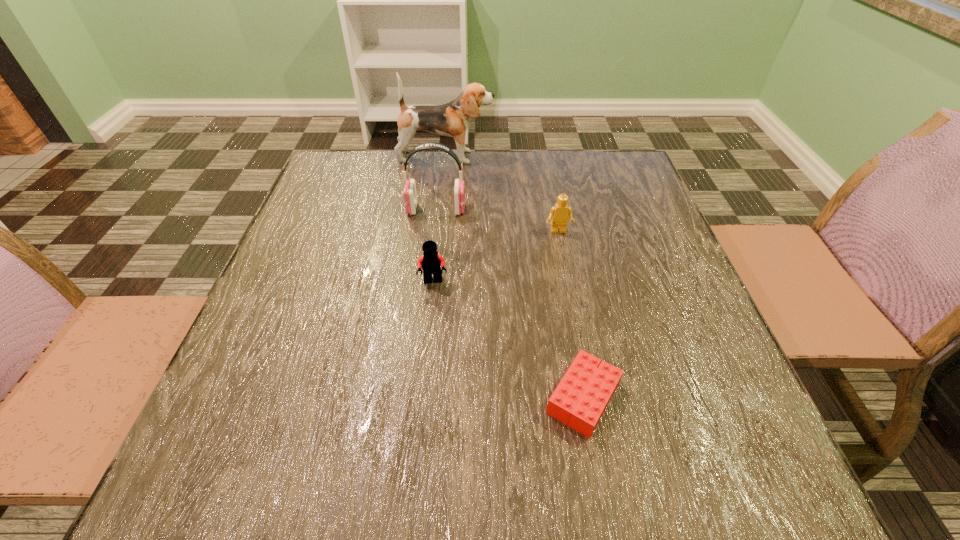
In order to click on vacant region at the far right corner of the desktop in this screenshot , I will do `click(625, 176)`.

Find the location of a particular element. The image size is (960, 540). vacant point located between the shortest Lego and the fourth nearest object is located at coordinates (510, 303).

Locate an element on the screen. The width and height of the screenshot is (960, 540). free space between the third farthest object and the puppy is located at coordinates (502, 194).

You are a GUI agent. You are given a task and a screenshot of the screen. Output one action in this format:
    pyautogui.click(x=<x>, y=<y>)
    Task: Click on the vacant space in between the nearest Lego and the farthest object
    This screenshot has width=960, height=540.
    Given the screenshot: What is the action you would take?
    pyautogui.click(x=515, y=278)

This screenshot has width=960, height=540. I want to click on blank region between the farthest object and the second nearest object, so click(x=440, y=219).

The image size is (960, 540). I want to click on free space between the shortest Lego and the tallest object, so click(x=515, y=278).

Where is `unoccupied area between the farthest Lego and the fourth shortest object`? The height and width of the screenshot is (540, 960). unoccupied area between the farthest Lego and the fourth shortest object is located at coordinates (497, 220).

Locate an element on the screen. This screenshot has height=540, width=960. empty location between the farthest object and the farthest Lego is located at coordinates [502, 194].

Locate an element on the screen. The image size is (960, 540). vacant space that is in between the second farthest Lego and the tallest object is located at coordinates (440, 219).

Find the location of a particular element. Image resolution: width=960 pixels, height=540 pixels. free spot between the farthest Lego and the puppy is located at coordinates coord(502,194).